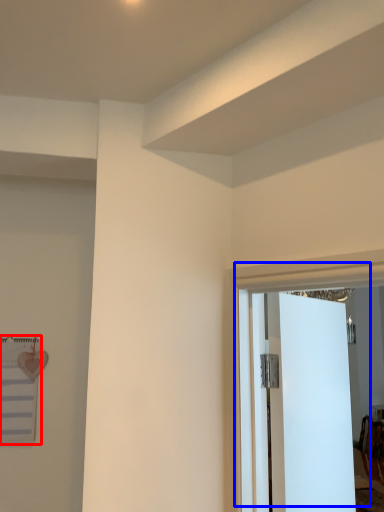
Question: Which object appears closest to the camera in this image, bulletin board (highlighted by a red box) or door (highlighted by a blue box)?

Choices:
 (A) bulletin board
 (B) door

Answer: (B)